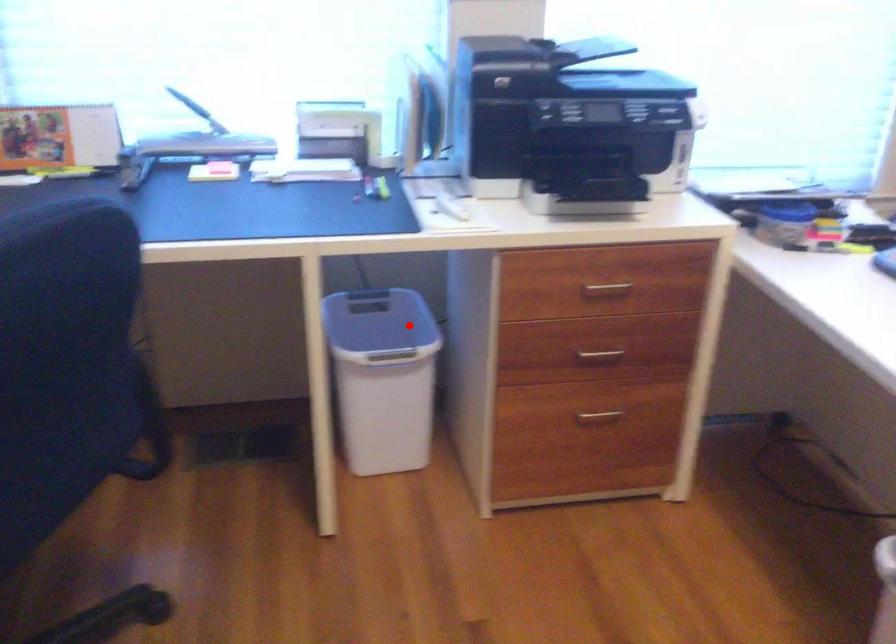
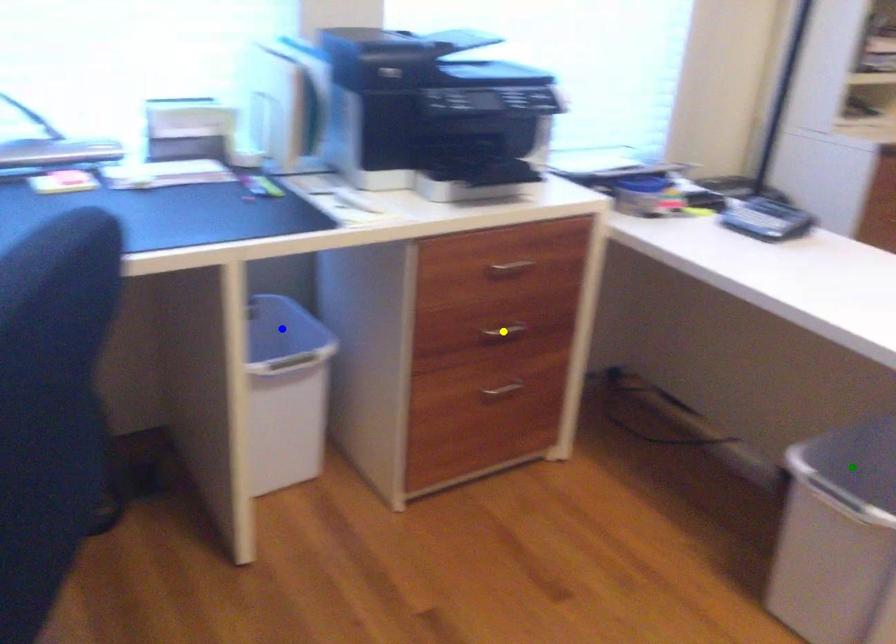
Question: I am providing you with two images of the same scene from different viewpoints. A red point is marked on the first image. You are given multiple points on the second image. Can you choose the point in image 2 that corresponds to the point in image 1?

Choices:
 (A) blue point
 (B) yellow point
 (C) green point

Answer: (A)